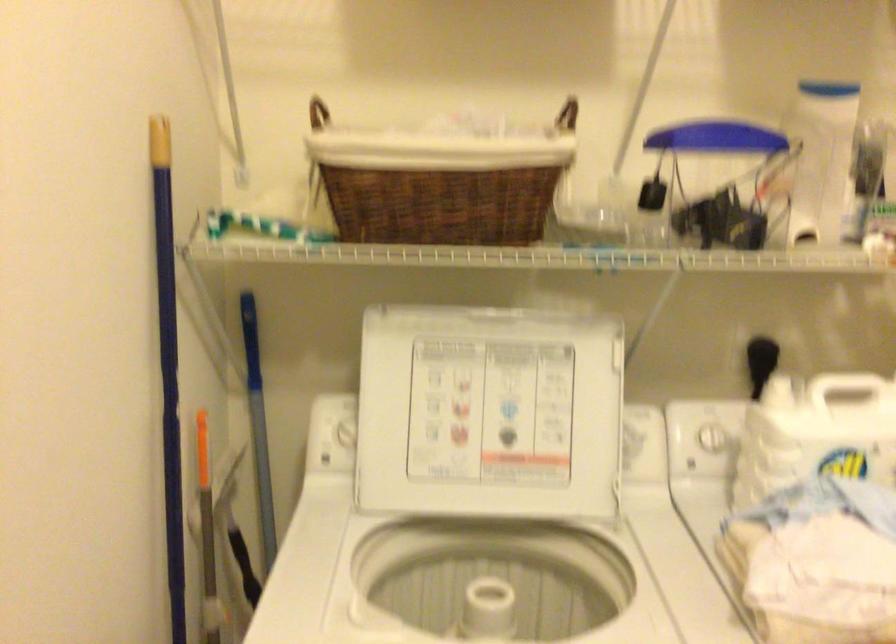
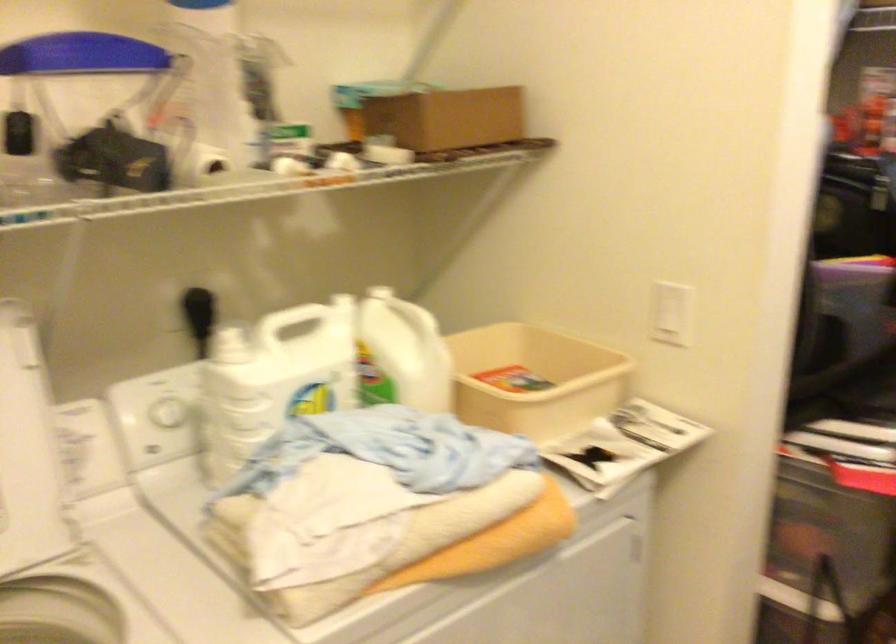
In the second image, find the point that corresponds to (x=712, y=440) in the first image.

(168, 412)